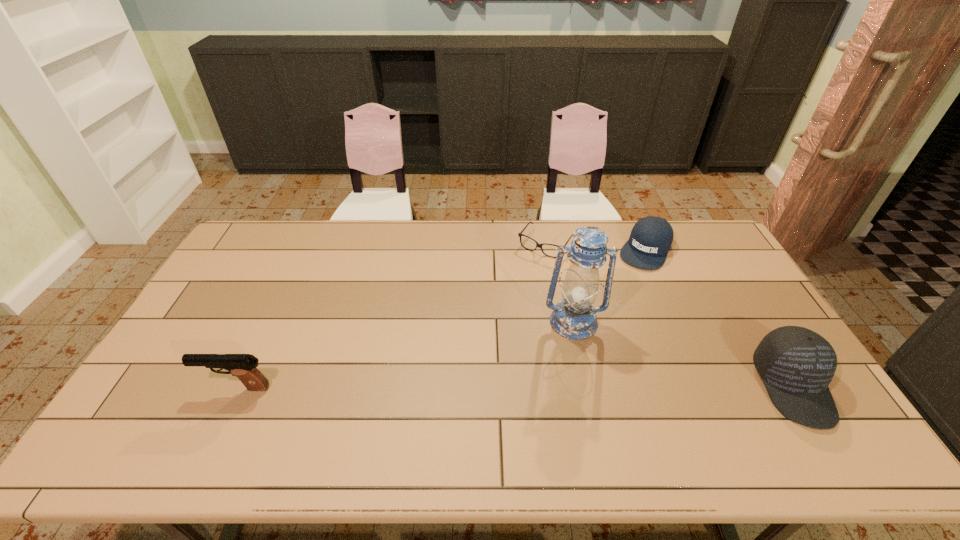
The height and width of the screenshot is (540, 960). In the image, there is a desktop. Identify the location of blank space at the left edge. (241, 288).

Where is `free spot at the near left corner of the desktop`? free spot at the near left corner of the desktop is located at coordinates (147, 396).

The height and width of the screenshot is (540, 960). In the image, there is a desktop. Identify the location of vacant space at the far right corner. pyautogui.click(x=710, y=255).

Locate an element on the screen. Image resolution: width=960 pixels, height=540 pixels. free space between the second shortest object and the rightmost object is located at coordinates (719, 318).

In order to click on vacant point located between the shorter baseball cap and the leftmost object in this screenshot , I will do `click(441, 319)`.

In order to click on free space between the pistol and the rightmost object in this screenshot , I will do pyautogui.click(x=515, y=387).

Identify the location of free spot between the leftmost object and the right baseball cap. (515, 387).

Find the location of a particular element. This screenshot has width=960, height=540. unoccupied position between the rightmost object and the pistol is located at coordinates (515, 387).

You are a GUI agent. You are given a task and a screenshot of the screen. Output one action in this format:
    pyautogui.click(x=<x>, y=<y>)
    Task: Click on the free point between the spectacles and the taller baseball cap
    The height and width of the screenshot is (540, 960).
    Given the screenshot: What is the action you would take?
    tap(669, 315)

This screenshot has height=540, width=960. Identify the location of object that ranks as the fourth closest to the right baseball cap. (243, 366).